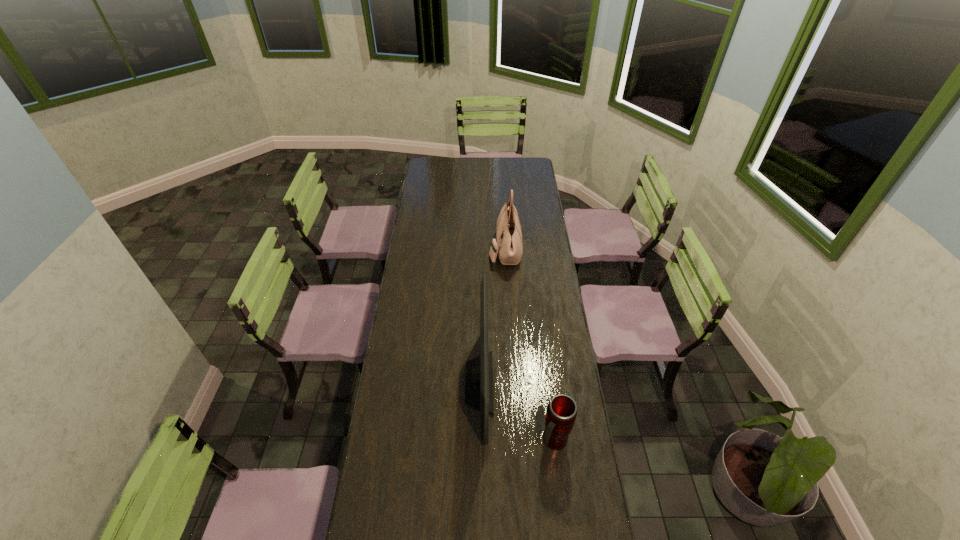
Select which object is the second closest to the thermos bottle. Please provide its 2D coordinates. Your answer should be formatted as a tuple, i.e. [(x, y)], where the tuple contains the x and y coordinates of a point satisfying the conditions above.

[(509, 246)]